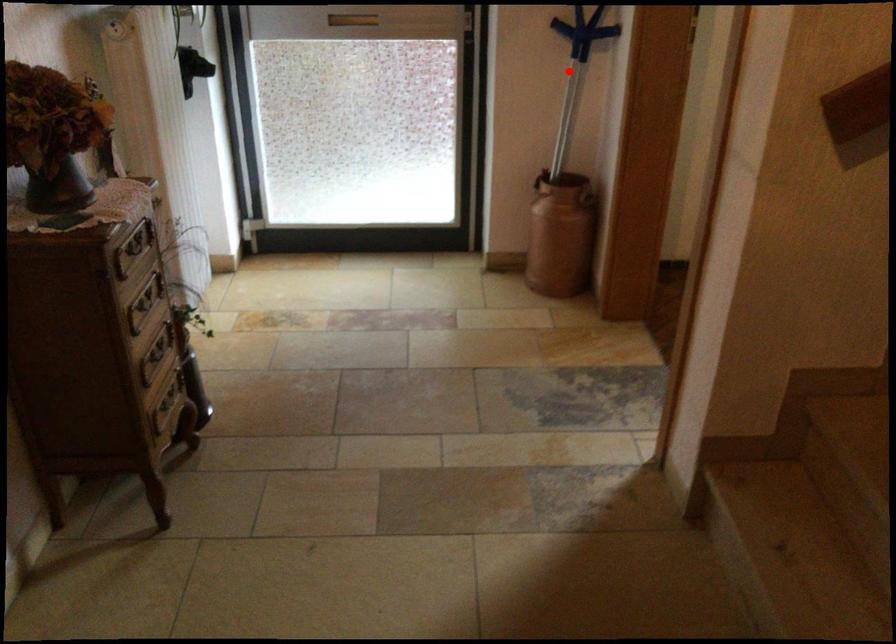
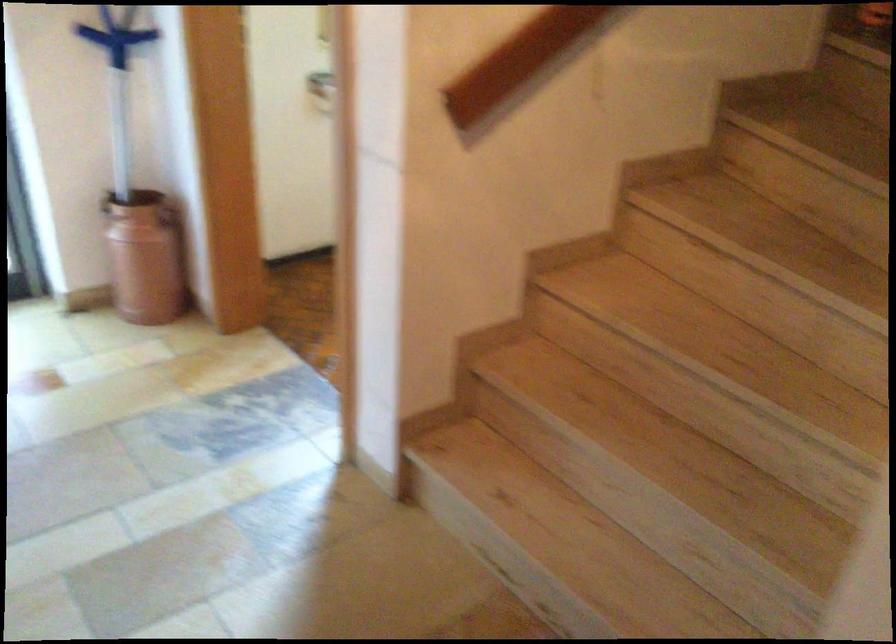
Question: I am providing you with two images of the same scene from different viewpoints. In image1, a red point is highlighted. Considering the same 3D point in image2, which of the following is correct?

Choices:
 (A) It is closer
 (B) It is farther

Answer: (A)